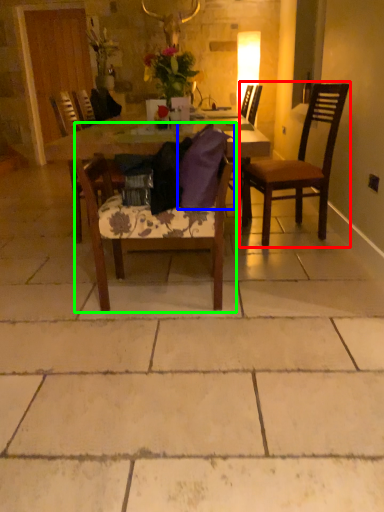
Question: Considering the real-world distances, which object is closest to chair (highlighted by a red box)? pillow (highlighted by a blue box) or chair (highlighted by a green box).

Choices:
 (A) pillow
 (B) chair

Answer: (A)